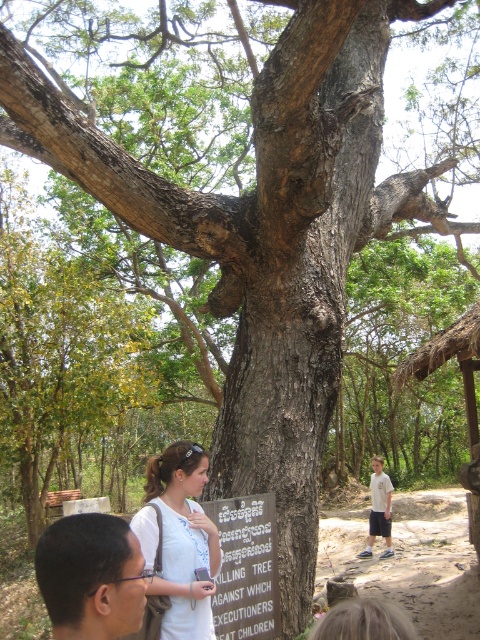
You are a photographer trying to capture a group photo of two people in the scene. The two people are the black hair at lower left and the light brown hair at lower center. To ensure both are in focus, you need to know their height difference. Which person is shorter?

The black hair at lower left is shorter than the light brown hair at lower center.

You are a photographer trying to capture a photo of the wooden signboard at center while also including the light brown hair at lower center in the frame. Based on their sizes, which object should you focus on first to ensure both are in the frame?

The light brown hair at lower center has a smaller size compared to wooden signboard at center, so you should focus on the wooden signboard at center first to ensure both are in the frame.